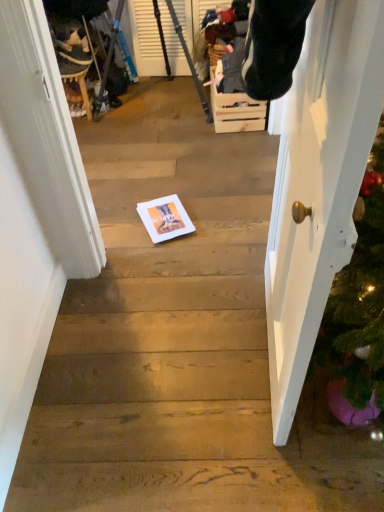
The image size is (384, 512). Identify the location of vacant region in front of white glossy door at right. (271, 443).